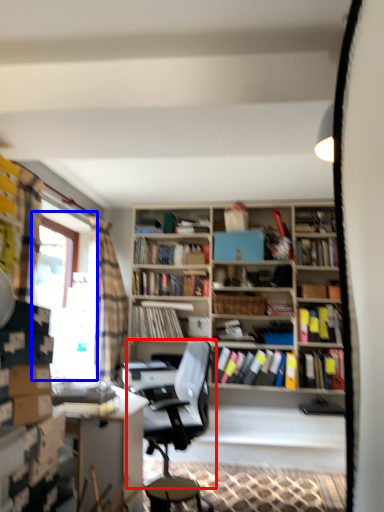
Question: Which of the following is the farthest to the observer, chair (highlighted by a red box) or window screen (highlighted by a blue box)?

Choices:
 (A) chair
 (B) window screen

Answer: (B)